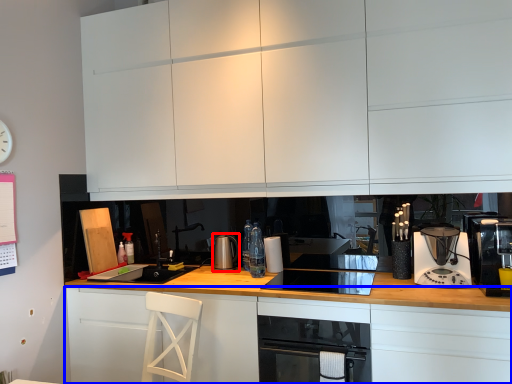
Question: Which point is closer to the camera, kitchen appliance (highlighted by a red box) or cabinetry (highlighted by a blue box)?

Choices:
 (A) kitchen appliance
 (B) cabinetry

Answer: (B)